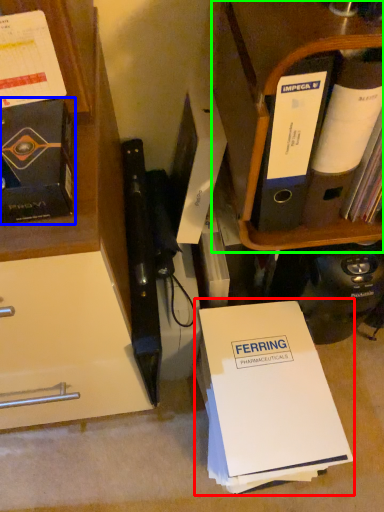
Question: Which object is positioned farthest from paperback book (highlighted by a red box)? Select from book (highlighted by a blue box) and shelf (highlighted by a green box).

Choices:
 (A) book
 (B) shelf

Answer: (A)